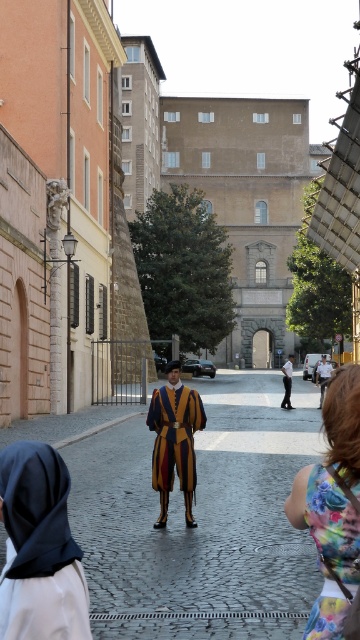
Question: Can you confirm if floral fabric dress at lower right is thinner than golden-yellow velvet robe at center?

Choices:
 (A) yes
 (B) no

Answer: (A)

Question: Is velvet yellow and purple robe at center to the right of golden-yellow fabric monk at center from the viewer's perspective?

Choices:
 (A) no
 (B) yes

Answer: (A)

Question: Estimate the real-world distances between objects in this image. Which object is closer to the floral dress at lower right?

Choices:
 (A) dark blue fabric headscarf at lower left
 (B) matte yellow and blue striped uniform at center

Answer: (A)

Question: Which point is farther from the camera taking this photo?

Choices:
 (A) (335, 534)
 (B) (158, 444)
 (C) (327, 362)
 (D) (356, 376)

Answer: (C)

Question: From the image, what is the correct spatial relationship of matte yellow and blue striped uniform at center in relation to dark blue fabric headscarf at lower left?

Choices:
 (A) below
 (B) above

Answer: (A)

Question: Which object appears closest to the camera in this image?

Choices:
 (A) golden-yellow fabric monk at center
 (B) golden-yellow velvet robe at center
 (C) matte yellow and blue striped uniform at center
 (D) floral fabric dress at lower right

Answer: (D)